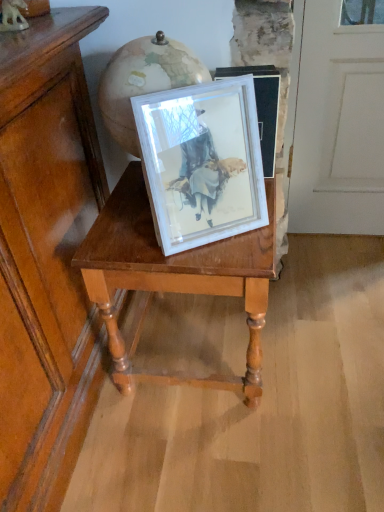
The width and height of the screenshot is (384, 512). Find the location of `white matte picture frame at center`. white matte picture frame at center is located at coordinates (202, 162).

This screenshot has height=512, width=384. What do you see at coordinates (202, 162) in the screenshot? I see `white matte picture frame at center` at bounding box center [202, 162].

This screenshot has width=384, height=512. In order to click on wooden table at center in this screenshot , I will do `click(174, 280)`.

What do you see at coordinates (174, 280) in the screenshot?
I see `wooden table at center` at bounding box center [174, 280].

This screenshot has width=384, height=512. Identify the location of white matte picture frame at center. (202, 162).

Consider the image. Does wooden table at center appear on the right side of white matte picture frame at center?

No.

Considering the positions of objects wooden table at center and white matte picture frame at center in the image provided, who is behind, wooden table at center or white matte picture frame at center?

wooden table at center is behind.

Is point (99, 233) closer to viewer compared to point (259, 214)?

No, it is behind (259, 214).

Consider the image. From the image's perspective, is wooden table at center above or below white matte picture frame at center?

Clearly, from the image's perspective, wooden table at center is below white matte picture frame at center.

From a real-world perspective, is wooden table at center above or below white matte picture frame at center?

From a real-world perspective, wooden table at center is physically below white matte picture frame at center.

Is wooden table at center wider than white matte picture frame at center?

Yes.

Which of these two, wooden table at center or white matte picture frame at center, stands shorter?

With less height is white matte picture frame at center.

Considering the relative sizes of wooden table at center and white matte picture frame at center in the image provided, is wooden table at center smaller than white matte picture frame at center?

Actually, wooden table at center might be larger than white matte picture frame at center.

Is white matte picture frame at center located within wooden table at center?

No.

Are wooden table at center and white matte picture frame at center located far from each other?

No.

Could you tell me if wooden table at center is facing white matte picture frame at center?

No, wooden table at center is not facing towards white matte picture frame at center.

How different are the orientations of wooden table at center and white matte picture frame at center in degrees?

29.9 degrees separate the facing orientations of wooden table at center and white matte picture frame at center.

How much distance is there between wooden table at center and white matte picture frame at center?

The distance of wooden table at center from white matte picture frame at center is 6.34 inches.

This screenshot has height=512, width=384. Identify the location of table on the left of white matte picture frame at center. (174, 280).

Considering the relative positions of white matte picture frame at center and wooden table at center in the image provided, is white matte picture frame at center to the right of wooden table at center from the viewer's perspective?

Indeed, white matte picture frame at center is positioned on the right side of wooden table at center.

Considering the positions of objects white matte picture frame at center and wooden table at center in the image provided, who is in front, white matte picture frame at center or wooden table at center?

white matte picture frame at center is in front.

Which is less distant, (235, 224) or (160, 262)?

The point (160, 262) is closer.

From the image's perspective, is white matte picture frame at center on wooden table at center?

Yes, from the image's perspective, white matte picture frame at center is over wooden table at center.

From a real-world perspective, which object stands above the other?

In real-world perspective, white matte picture frame at center is above.

Which of these two, white matte picture frame at center or wooden table at center, is thinner?

Thinner between the two is white matte picture frame at center.

Is white matte picture frame at center taller than wooden table at center?

Incorrect, the height of white matte picture frame at center is not larger of that of wooden table at center.

Considering the relative sizes of white matte picture frame at center and wooden table at center in the image provided, is white matte picture frame at center smaller than wooden table at center?

Indeed, white matte picture frame at center has a smaller size compared to wooden table at center.

Is wooden table at center inside white matte picture frame at center?

No.

Is white matte picture frame at center positioned far away from wooden table at center?

No, white matte picture frame at center is not far away from wooden table at center.

Is white matte picture frame at center aimed at wooden table at center?

No.

How many degrees apart are the facing directions of white matte picture frame at center and wooden table at center?

They differ by 29.9 degrees in their facing directions.

How distant is white matte picture frame at center from wooden table at center?

white matte picture frame at center is 16.11 centimeters away from wooden table at center.

Locate an element on the screen. This screenshot has width=384, height=512. table that is behind the white matte picture frame at center is located at coordinates (174, 280).

Locate an element on the screen. Image resolution: width=384 pixels, height=512 pixels. table located underneath the white matte picture frame at center (from a real-world perspective) is located at coordinates (174, 280).

Identify the location of picture frame above the wooden table at center (from the image's perspective). The width and height of the screenshot is (384, 512). coord(202,162).